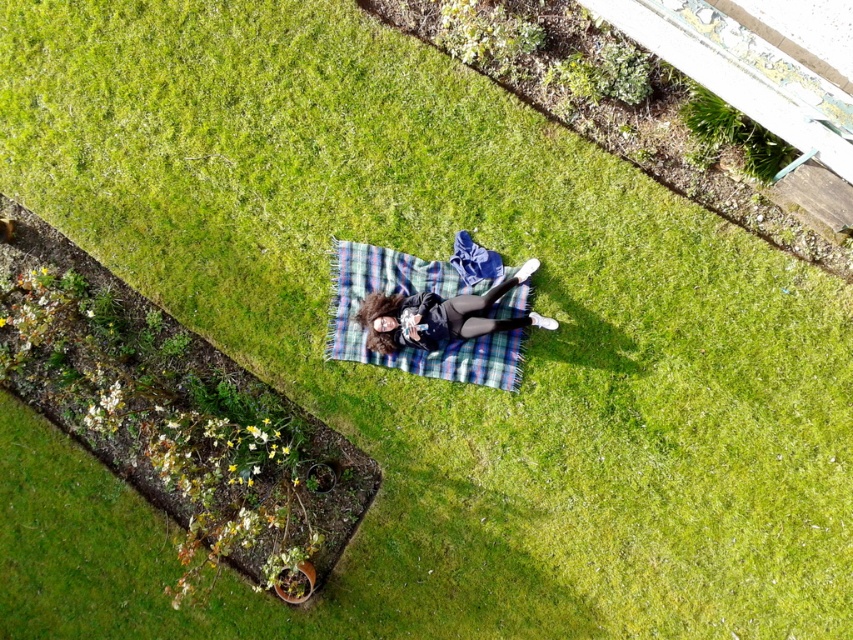
Question: Which object is farther from the camera taking this photo?

Choices:
 (A) matte black jacket at center
 (B) plaid fabric blanket at center

Answer: (B)

Question: Does plaid fabric blanket at center have a smaller size compared to matte black jacket at center?

Choices:
 (A) no
 (B) yes

Answer: (B)

Question: Does plaid fabric blanket at center have a smaller size compared to matte black jacket at center?

Choices:
 (A) yes
 (B) no

Answer: (A)

Question: Is plaid fabric blanket at center wider than matte black jacket at center?

Choices:
 (A) no
 (B) yes

Answer: (B)

Question: Which of the following is the farthest from the observer?

Choices:
 (A) (419, 317)
 (B) (357, 244)

Answer: (B)

Question: Which of the following is the closest to the observer?

Choices:
 (A) (405, 346)
 (B) (521, 296)

Answer: (A)